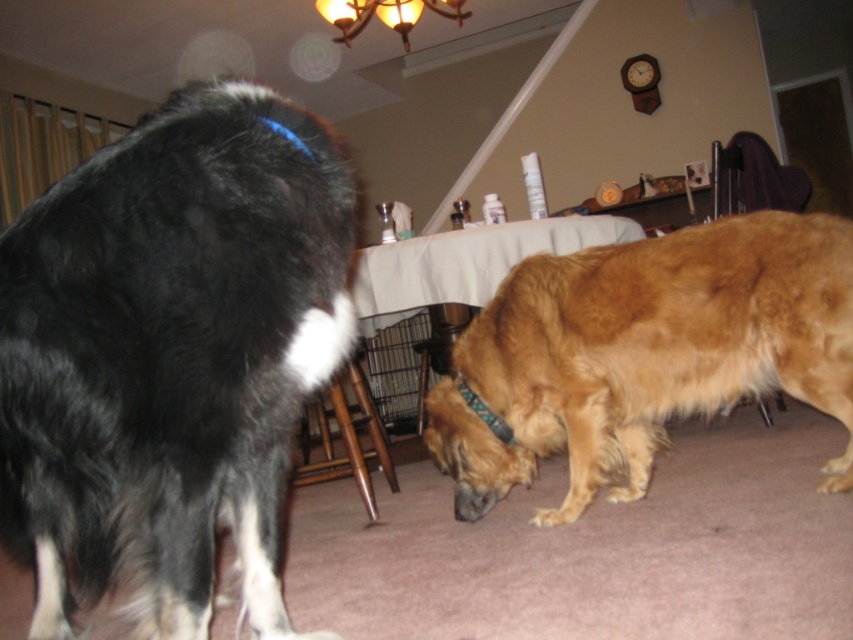
You are a GUI agent. You are given a task and a screenshot of the screen. Output one action in this format:
    pyautogui.click(x=<x>, y=<y>)
    Task: Click on the black fluffy dog at left
    The width and height of the screenshot is (853, 640).
    Given the screenshot: What is the action you would take?
    171,355

Looking at this image, is black fluffy dog at left shorter than golden fur dog at lower right?

No.

Does point (0, 467) come closer to viewer compared to point (582, 396)?

That is True.

Where is `black fluffy dog at left`? black fluffy dog at left is located at coordinates (171, 355).